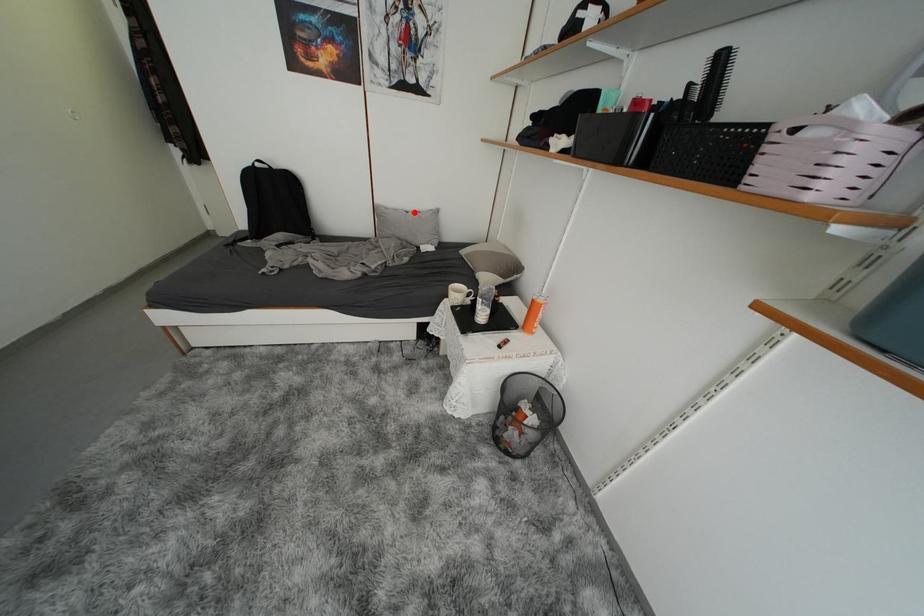
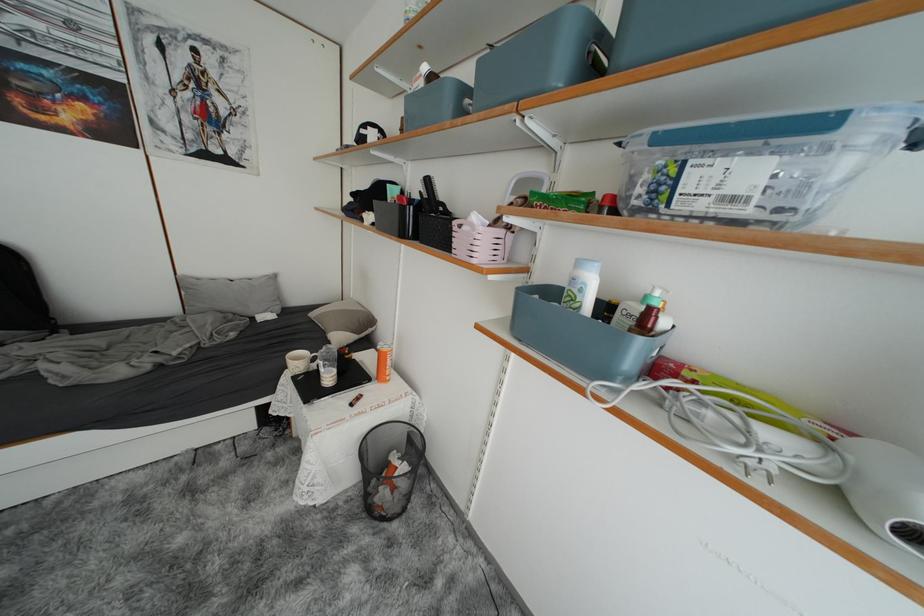
In the second image, find the point that corresponds to the highlighted location in the first image.

(238, 281)